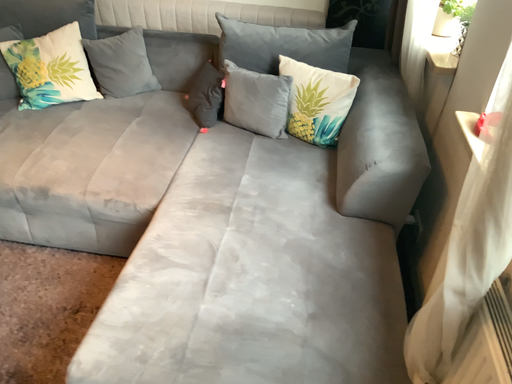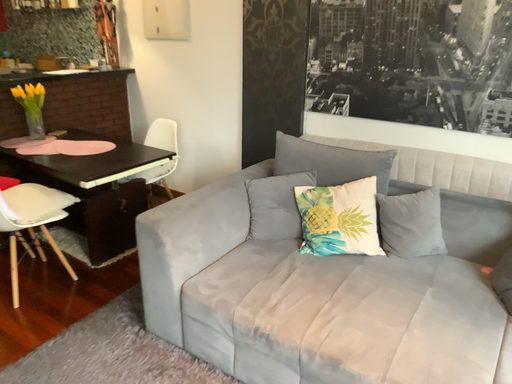
Question: How did the camera likely rotate when shooting the video?

Choices:
 (A) rotated downward
 (B) rotated upward

Answer: (B)